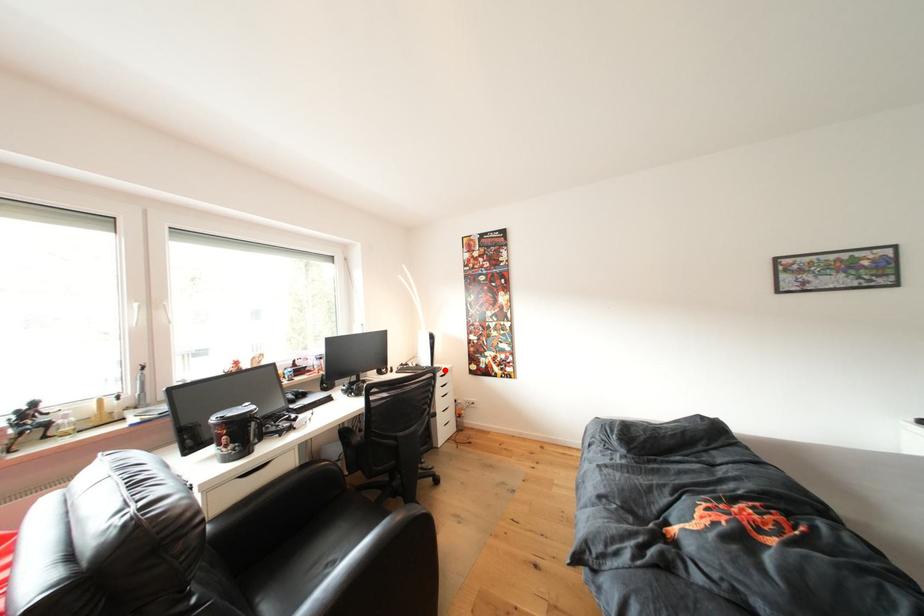
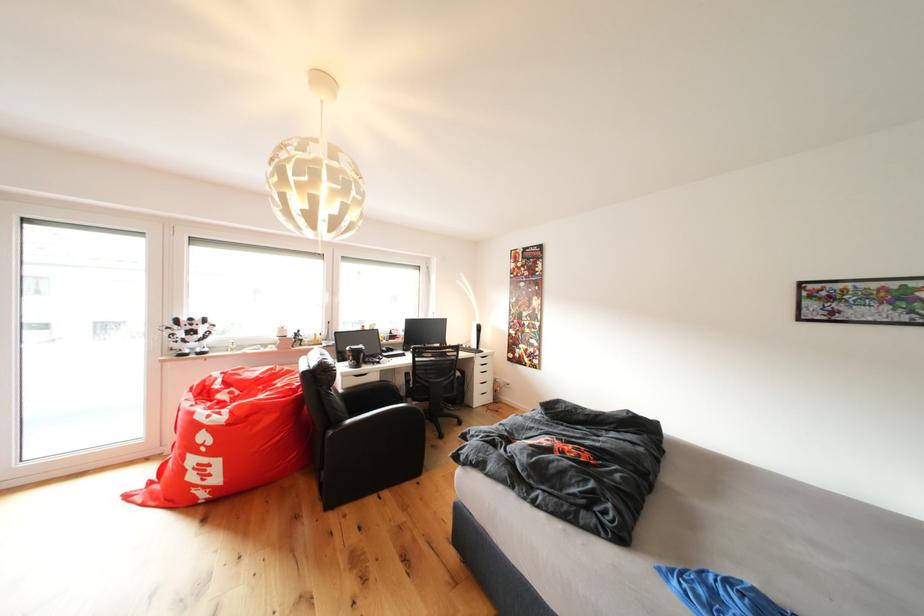
Question: I am providing you with two images of the same scene from different viewpoints. Given a red point in image1, look at the same physical point in image2. Is it:

Choices:
 (A) Closer to the viewpoint
 (B) Farther from the viewpoint

Answer: (A)